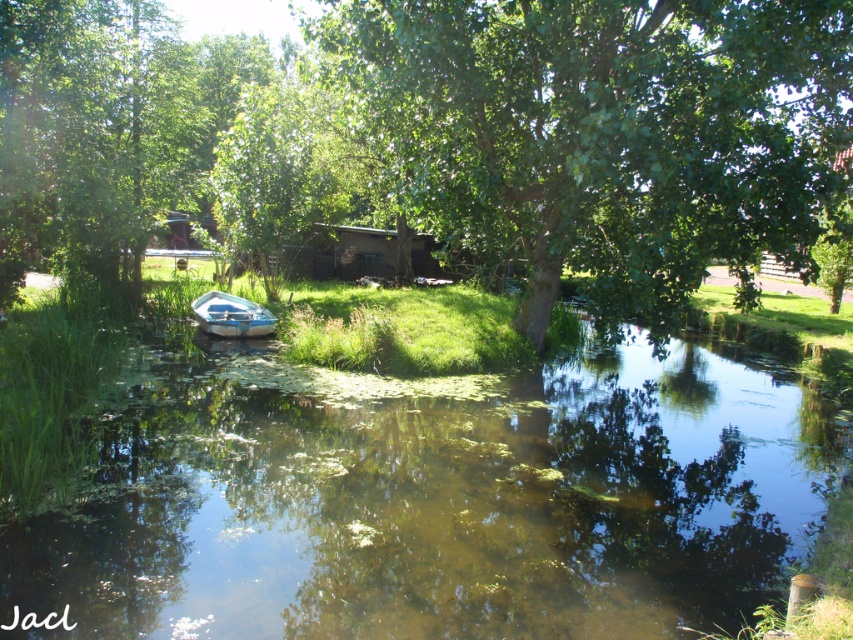
You are standing on the shore looking at the green leafy tree at center and the white plastic boat at center. Which object is higher from the ground?

The green leafy tree at center is above the white plastic boat at center, so the green leafy tree at center is higher from the ground.